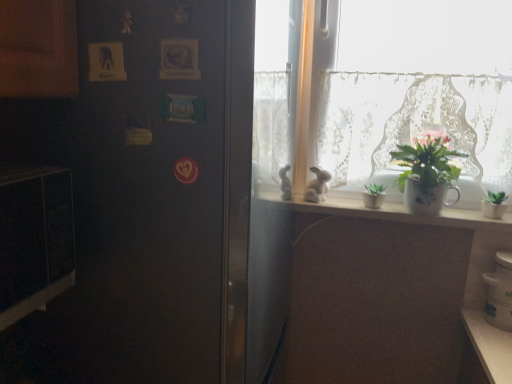
Question: From the image's perspective, does satin black refrigerator at left appear higher than white glossy jar at lower right?

Choices:
 (A) no
 (B) yes

Answer: (B)

Question: Is satin black refrigerator at left positioned with its back to white glossy jar at lower right?

Choices:
 (A) yes
 (B) no

Answer: (B)

Question: Can you confirm if satin black refrigerator at left is shorter than white glossy jar at lower right?

Choices:
 (A) no
 (B) yes

Answer: (A)

Question: From a real-world perspective, is satin black refrigerator at left physically below white glossy jar at lower right?

Choices:
 (A) yes
 (B) no

Answer: (B)

Question: Can you confirm if satin black refrigerator at left is smaller than white glossy jar at lower right?

Choices:
 (A) no
 (B) yes

Answer: (A)

Question: From a real-world perspective, is satin black refrigerator at left positioned over white glossy jar at lower right based on gravity?

Choices:
 (A) yes
 (B) no

Answer: (A)

Question: Is white matte rabbit at window to the right of white wooden shelf at upper center from the viewer's perspective?

Choices:
 (A) yes
 (B) no

Answer: (B)

Question: Is white matte rabbit at window positioned before white wooden shelf at upper center?

Choices:
 (A) no
 (B) yes

Answer: (A)

Question: Is white matte rabbit at window next to white wooden shelf at upper center and touching it?

Choices:
 (A) yes
 (B) no

Answer: (B)

Question: Could you tell me if white matte rabbit at window is turned towards white wooden shelf at upper center?

Choices:
 (A) no
 (B) yes

Answer: (A)

Question: Considering the relative sizes of white matte rabbit at window and white wooden shelf at upper center in the image provided, is white matte rabbit at window bigger than white wooden shelf at upper center?

Choices:
 (A) yes
 (B) no

Answer: (B)

Question: Does white matte rabbit at window have a greater width compared to white wooden shelf at upper center?

Choices:
 (A) no
 (B) yes

Answer: (A)

Question: From a real-world perspective, does white lace curtain at upper right stand above satin black refrigerator at left?

Choices:
 (A) no
 (B) yes

Answer: (B)